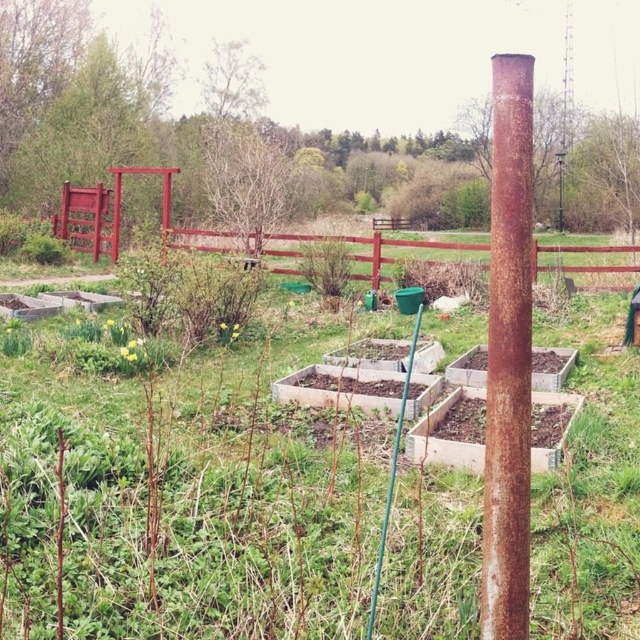
Who is positioned more to the left, rusty metal pole at center or rustic wooden fence at center?

rusty metal pole at center is more to the left.

Is point (506, 362) in front of point (589, 260)?

Yes.

Where is `rusty metal pole at center`? This screenshot has width=640, height=640. rusty metal pole at center is located at coordinates (508, 356).